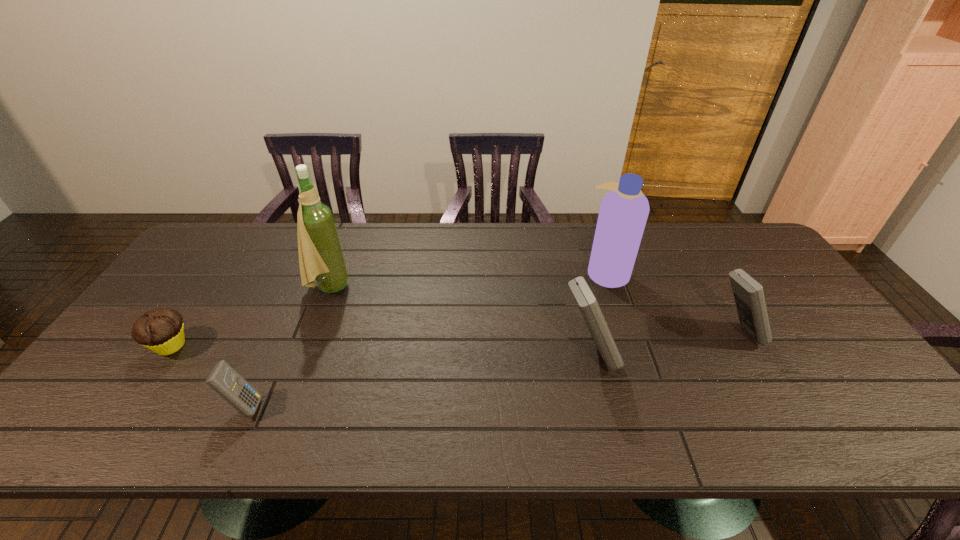
Find the location of a particular element. The height and width of the screenshot is (540, 960). calculator object that ranks as the closest to the wine bottle is located at coordinates (223, 379).

Locate an element on the screen. The width and height of the screenshot is (960, 540). calculator identified as the closest to the muffin is located at coordinates (223, 379).

Identify the location of vacant region that satisfies the following two spatial constraints: 1. on the front-facing side of the wine bottle; 2. on the front side of the leftmost object. The height and width of the screenshot is (540, 960). (306, 346).